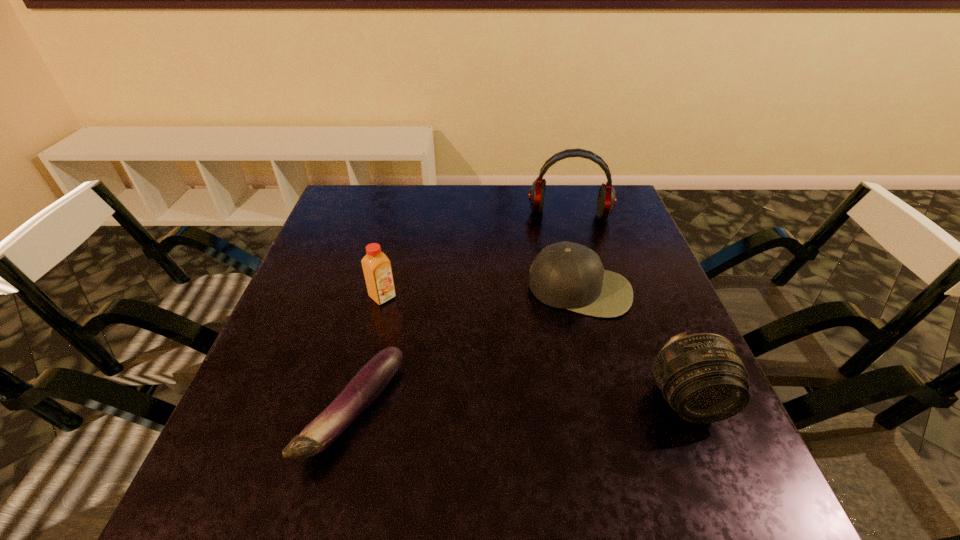
Where is `vacant space on the desktop that is between the eggplant and the telephoto lens and is positioned on the ear cups of the tallest object`? The image size is (960, 540). vacant space on the desktop that is between the eggplant and the telephoto lens and is positioned on the ear cups of the tallest object is located at coordinates (564, 404).

Where is `free spot on the desktop that is between the eggplant and the telephoto lens and is positioned on the front and back of the orange juice`? This screenshot has width=960, height=540. free spot on the desktop that is between the eggplant and the telephoto lens and is positioned on the front and back of the orange juice is located at coordinates (521, 406).

Where is `free space on the desktop that is between the shortest object and the telephoto lens and is positioned on the brim of the cap`? The height and width of the screenshot is (540, 960). free space on the desktop that is between the shortest object and the telephoto lens and is positioned on the brim of the cap is located at coordinates (563, 404).